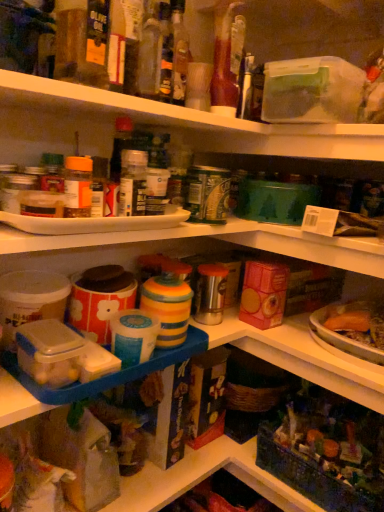
Question: Would you consider translucent glass bottle at upper center, which is counted as the 3th bottle, starting from the right, to be distant from translucent plastic container at lower right?

Choices:
 (A) yes
 (B) no

Answer: (B)

Question: Is translucent glass bottle at upper center, the second bottle from the left, shorter than translucent plastic container at lower right?

Choices:
 (A) yes
 (B) no

Answer: (A)

Question: Is translucent glass bottle at upper center, which is counted as the 3th bottle, starting from the right, with translucent plastic container at lower right?

Choices:
 (A) no
 (B) yes

Answer: (A)

Question: Is translucent glass bottle at upper center, which is counted as the 3th bottle, starting from the right, positioned beyond the bounds of translucent plastic container at lower right?

Choices:
 (A) no
 (B) yes

Answer: (B)

Question: Is translucent plastic container at lower right at the back of translucent glass bottle at upper center, the second bottle from the left?

Choices:
 (A) yes
 (B) no

Answer: (B)

Question: From the image's perspective, is translucent glass bottle at upper center, the fourth bottle in the left-to-right sequence, located above or below translucent glass bottle at center, which is the 2th bottle from right to left?

Choices:
 (A) below
 (B) above

Answer: (A)

Question: Based on their sizes in the image, would you say translucent glass bottle at upper center, acting as the first bottle starting from the right, is bigger or smaller than translucent glass bottle at center, positioned as the 3th bottle in left-to-right order?

Choices:
 (A) big
 (B) small

Answer: (A)

Question: Is translucent glass bottle at upper center, acting as the first bottle starting from the right, wider or thinner than translucent glass bottle at center, which is the 2th bottle from right to left?

Choices:
 (A) thin
 (B) wide

Answer: (B)

Question: Relative to translucent glass bottle at center, positioned as the 3th bottle in left-to-right order, is translucent glass bottle at upper center, the fourth bottle in the left-to-right sequence, in front or behind?

Choices:
 (A) front
 (B) behind

Answer: (A)

Question: From the image's perspective, relative to translucent glass bottle at center, positioned as the 3th bottle in left-to-right order, is translucent plastic container at lower right above or below?

Choices:
 (A) below
 (B) above

Answer: (A)

Question: Looking at their shapes, would you say translucent plastic container at lower right is wider or thinner than translucent glass bottle at center, which is the 2th bottle from right to left?

Choices:
 (A) wide
 (B) thin

Answer: (A)

Question: In terms of height, does translucent plastic container at lower right look taller or shorter compared to translucent glass bottle at center, positioned as the 3th bottle in left-to-right order?

Choices:
 (A) short
 (B) tall

Answer: (A)

Question: Is translucent plastic container at lower right inside the boundaries of translucent glass bottle at center, which is the 2th bottle from right to left, or outside?

Choices:
 (A) outside
 (B) inside

Answer: (A)

Question: Based on their sizes in the image, would you say translucent plastic container at lower right is bigger or smaller than translucent glass bottle at upper center, the fourth bottle in the left-to-right sequence?

Choices:
 (A) big
 (B) small

Answer: (A)

Question: From the image's perspective, is translucent plastic container at lower right above or below translucent glass bottle at upper center, the fourth bottle in the left-to-right sequence?

Choices:
 (A) above
 (B) below

Answer: (B)